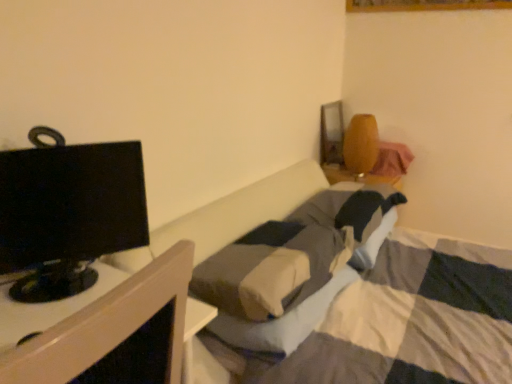
Question: From a real-world perspective, is black glossy monitor at left on top of black glossy monitor at left?

Choices:
 (A) yes
 (B) no

Answer: (B)

Question: From the image's perspective, is black glossy monitor at left located beneath black glossy monitor at left?

Choices:
 (A) yes
 (B) no

Answer: (A)

Question: Does black glossy monitor at left turn towards black glossy monitor at left?

Choices:
 (A) no
 (B) yes

Answer: (A)

Question: Considering the relative sizes of black glossy monitor at left and black glossy monitor at left in the image provided, is black glossy monitor at left thinner than black glossy monitor at left?

Choices:
 (A) yes
 (B) no

Answer: (B)

Question: Is black glossy monitor at left turned away from black glossy monitor at left?

Choices:
 (A) no
 (B) yes

Answer: (A)

Question: Is black glossy monitor at left bigger than black glossy monitor at left?

Choices:
 (A) no
 (B) yes

Answer: (B)

Question: Would you say black glossy monitor at left is part of black glossy monitor at left's contents?

Choices:
 (A) no
 (B) yes

Answer: (A)

Question: From the image's perspective, does black glossy monitor at left appear higher than black glossy monitor at left?

Choices:
 (A) no
 (B) yes

Answer: (B)

Question: Can you confirm if black glossy monitor at left is positioned to the left of black glossy monitor at left?

Choices:
 (A) yes
 (B) no

Answer: (A)

Question: Is black glossy monitor at left oriented towards black glossy monitor at left?

Choices:
 (A) yes
 (B) no

Answer: (B)

Question: Is black glossy monitor at left turned away from black glossy monitor at left?

Choices:
 (A) no
 (B) yes

Answer: (A)

Question: Is black glossy monitor at left at the right side of black glossy monitor at left?

Choices:
 (A) yes
 (B) no

Answer: (B)

Question: Based on their positions, is black glossy monitor at left located to the left or right of black glossy monitor at left?

Choices:
 (A) right
 (B) left

Answer: (A)